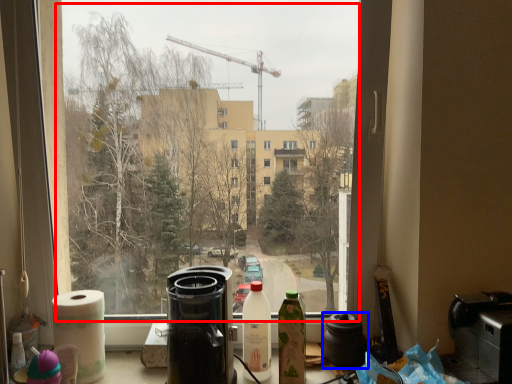
Question: Among these objects, which one is farthest to the camera, bay window (highlighted by a red box) or coffeepot (highlighted by a blue box)?

Choices:
 (A) bay window
 (B) coffeepot

Answer: (B)